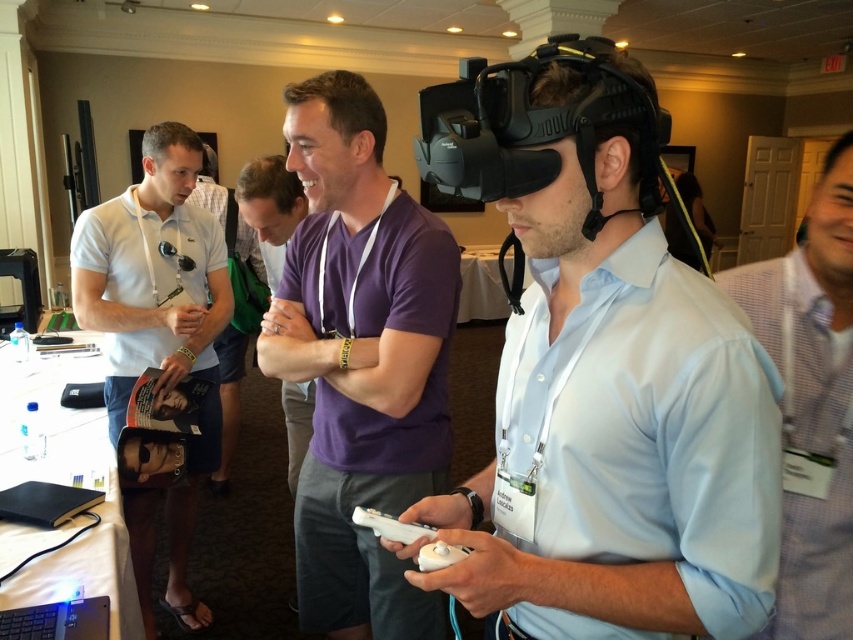
Between purple matte shirt at center and white matte game controller at center, which one is positioned higher?

purple matte shirt at center is higher up.

Which is behind, point (397, 600) or point (358, 509)?

The point (397, 600) is more distant.

Between point (440, 401) and point (426, 545), which one is positioned in front?

Positioned in front is point (426, 545).

You are a GUI agent. You are given a task and a screenshot of the screen. Output one action in this format:
    pyautogui.click(x=<x>, y=<y>)
    Task: Click on the purple matte shirt at center
    The width and height of the screenshot is (853, 640).
    Given the screenshot: What is the action you would take?
    pyautogui.click(x=360, y=358)

In the scene shown: Does matte black vr headset at center have a lesser width compared to white matte game controller at center?

No.

Is matte black vr headset at center bigger than white matte game controller at center?

Indeed, matte black vr headset at center has a larger size compared to white matte game controller at center.

Find the location of a particular element. The height and width of the screenshot is (640, 853). matte black vr headset at center is located at coordinates (618, 433).

Consider the image. Is white matte polo shirt at left further to camera compared to white matte game controller at center?

Yes, white matte polo shirt at left is behind white matte game controller at center.

Looking at this image, who is more forward, (70, 273) or (386, 534)?

Point (386, 534) is in front.

What are the coordinates of `white matte polo shirt at left` in the screenshot? It's located at (158, 332).